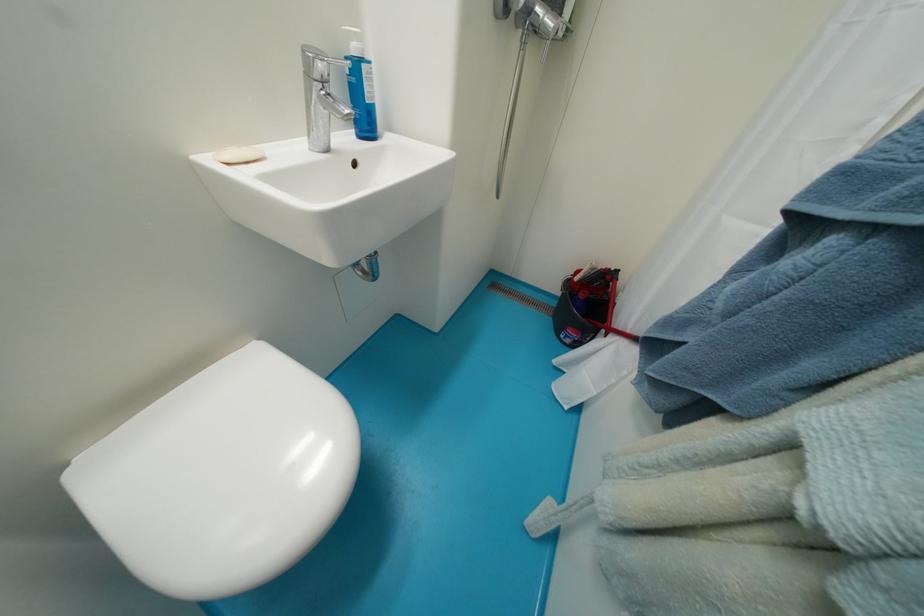
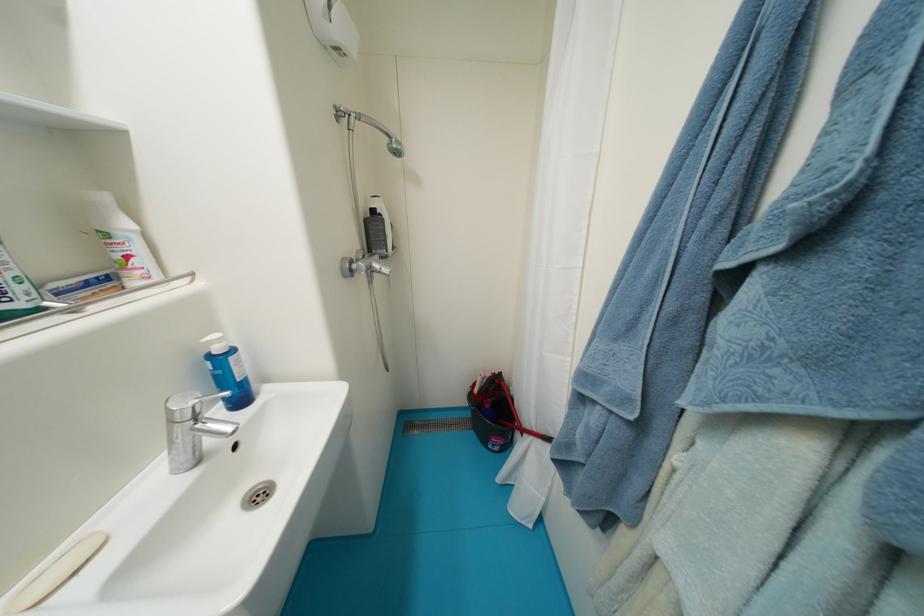
Find the pixel in the second image that matches pixel 363 41 in the first image.

(225, 342)